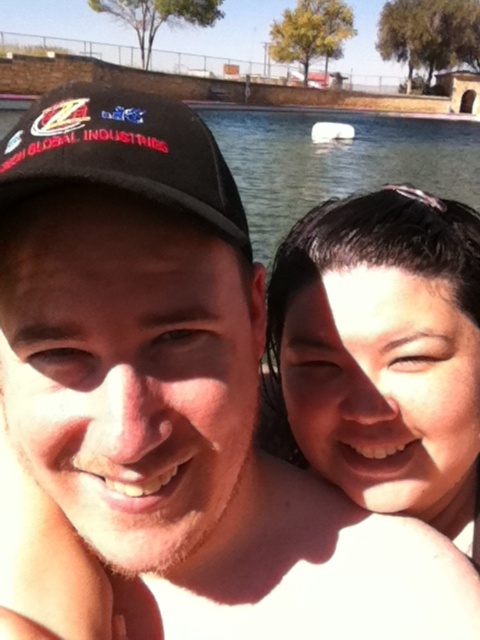
Is smooth skin face at upper right in front of black fabric baseball cap at upper left?

No, smooth skin face at upper right is further to the viewer.

Looking at this image, is smooth skin face at upper right to the left of black fabric baseball cap at upper left from the viewer's perspective?

Incorrect, smooth skin face at upper right is not on the left side of black fabric baseball cap at upper left.

Describe the element at coordinates (384, 352) in the screenshot. I see `smooth skin face at upper right` at that location.

The width and height of the screenshot is (480, 640). Find the location of `smooth skin face at upper right`. smooth skin face at upper right is located at coordinates (384, 352).